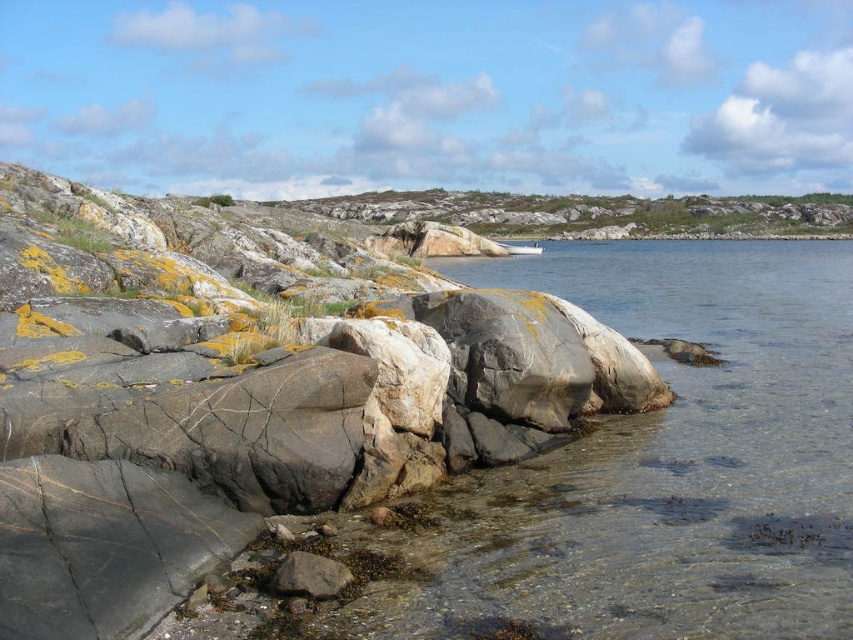
Who is shorter, clear water at lower right or gray rough rock at lower center?

gray rough rock at lower center is shorter.

Can you confirm if clear water at lower right is positioned to the left of gray rough rock at lower center?

No, clear water at lower right is not to the left of gray rough rock at lower center.

Who is more forward, (807,365) or (303,579)?

Point (303,579) is in front.

You are a GUI agent. You are given a task and a screenshot of the screen. Output one action in this format:
    pyautogui.click(x=<x>, y=<y>)
    Task: Click on the clear water at lower right
    
    Given the screenshot: What is the action you would take?
    pyautogui.click(x=677, y=460)

Is gray/rough rock at center wider than clear water at lower right?

Incorrect, gray/rough rock at center's width does not surpass clear water at lower right's.

Does gray/rough rock at center have a smaller size compared to clear water at lower right?

Incorrect, gray/rough rock at center is not smaller in size than clear water at lower right.

Based on the photo, who is more forward, (434, 378) or (780, 564)?

Point (780, 564) is more forward.

Identify the location of gray/rough rock at center. The image size is (853, 640). (242, 394).

Can you confirm if gray/rough rock at center is positioned below gray rough rock at lower center?

No.

Describe the element at coordinates (242, 394) in the screenshot. I see `gray/rough rock at center` at that location.

Identify the location of gray/rough rock at center. Image resolution: width=853 pixels, height=640 pixels. (242, 394).

I want to click on gray/rough rock at center, so click(242, 394).